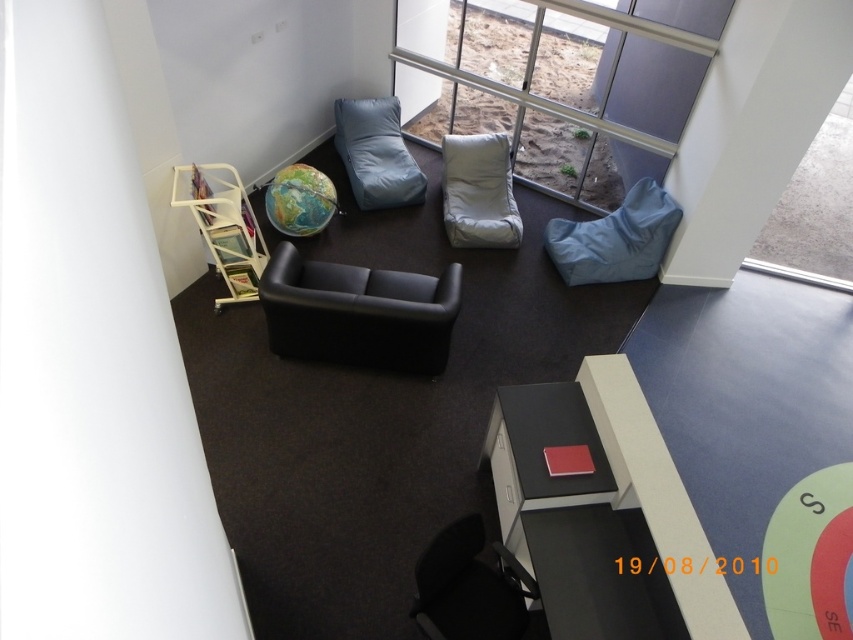
Between point (689, 24) and point (466, 227), which one is positioned in front?

Point (689, 24) is more forward.

The width and height of the screenshot is (853, 640). Find the location of `transparent glass window at upper center`. transparent glass window at upper center is located at coordinates (566, 86).

The height and width of the screenshot is (640, 853). Describe the element at coordinates (566, 86) in the screenshot. I see `transparent glass window at upper center` at that location.

The image size is (853, 640). Identify the location of transparent glass window at upper center. (566, 86).

Is black leather couch at center shorter than matte blue bean bag at upper center?

Yes.

Is black leather couch at center below matte blue bean bag at upper center?

Indeed, black leather couch at center is positioned under matte blue bean bag at upper center.

Where is `black leather couch at center`? The height and width of the screenshot is (640, 853). black leather couch at center is located at coordinates (358, 314).

Can you confirm if transparent glass window at upper center is wider than transparent glass window at upper right?

No, transparent glass window at upper center is not wider than transparent glass window at upper right.

Between point (453, 109) and point (791, 266), which one is positioned behind?

Point (453, 109)

The image size is (853, 640). In order to click on transparent glass window at upper center in this screenshot , I will do `click(566, 86)`.